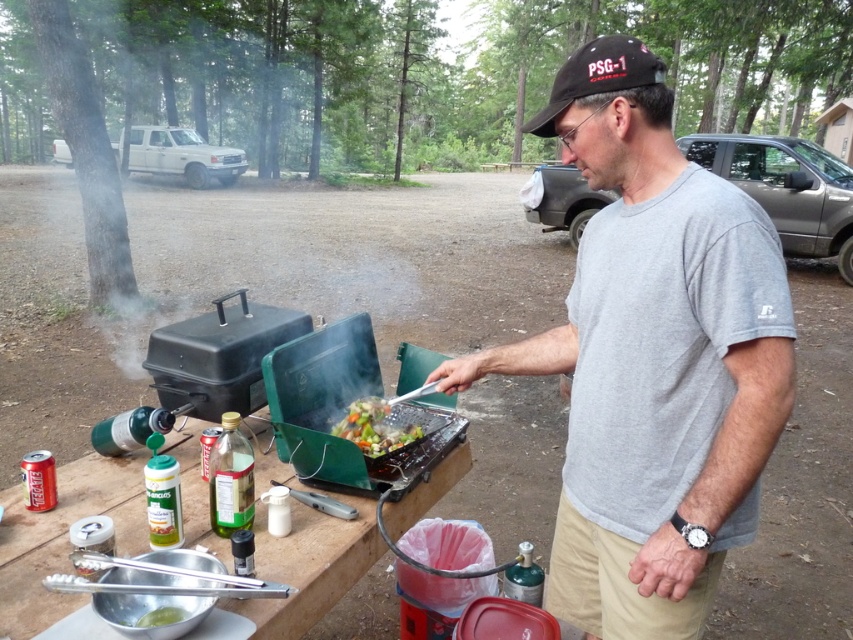
Consider the image. Measure the distance between gray cotton t-shirt at center and wooden table at center.

gray cotton t-shirt at center is 21.62 inches from wooden table at center.

Is point (752, 259) positioned behind point (83, 493)?

No, (752, 259) is closer to viewer.

At what (x,y) coordinates should I click in order to perform the action: click on gray cotton t-shirt at center. Please return your answer as a coordinate pair (x, y). The height and width of the screenshot is (640, 853). Looking at the image, I should click on (653, 358).

Is gray cotton t-shirt at center positioned in front of vibrant mixed vegetables at center?

Yes, it is.

Does gray cotton t-shirt at center have a lesser width compared to vibrant mixed vegetables at center?

In fact, gray cotton t-shirt at center might be wider than vibrant mixed vegetables at center.

The width and height of the screenshot is (853, 640). Describe the element at coordinates (653, 358) in the screenshot. I see `gray cotton t-shirt at center` at that location.

At what (x,y) coordinates should I click in order to perform the action: click on gray cotton t-shirt at center. Please return your answer as a coordinate pair (x, y). This screenshot has height=640, width=853. Looking at the image, I should click on (653, 358).

I want to click on wooden table at center, so click(62, 536).

Can you confirm if wooden table at center is positioned to the right of vibrant mixed vegetables at center?

No, wooden table at center is not to the right of vibrant mixed vegetables at center.

Measure the distance between wooden table at center and camera.

The distance of wooden table at center from camera is 3.41 feet.

What are the coordinates of `wooden table at center` in the screenshot? It's located at (62, 536).